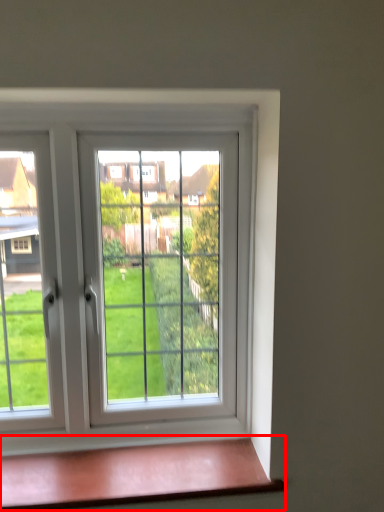
Question: From the image's perspective, considering the relative positions of window sill (annotated by the red box) and window in the image provided, where is window sill (annotated by the red box) located with respect to the staircase?

Choices:
 (A) below
 (B) above

Answer: (A)